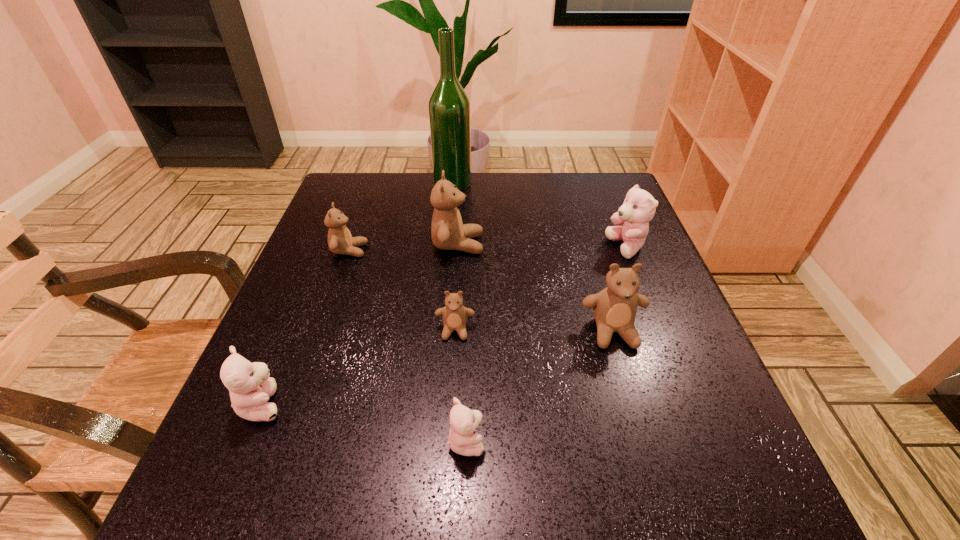
You are a GUI agent. You are given a task and a screenshot of the screen. Output one action in this format:
    pyautogui.click(x=<x>, y=<y>)
    Task: Click on the green alcohol
    
    Given the screenshot: What is the action you would take?
    pyautogui.click(x=449, y=107)

Where is `the farthest object`? the farthest object is located at coordinates (449, 107).

Identify the location of the tallest teddy bear. This screenshot has height=540, width=960. (448, 232).

You are a GUI agent. You are given a task and a screenshot of the screen. Output one action in this format:
    pyautogui.click(x=<x>, y=<y>)
    Task: Click on the seventh shortest object
    The image size is (960, 540).
    Given the screenshot: What is the action you would take?
    pyautogui.click(x=448, y=232)

Where is `the farthest pink teddy bear`? The height and width of the screenshot is (540, 960). the farthest pink teddy bear is located at coordinates (639, 206).

This screenshot has height=540, width=960. I want to click on the rightmost pink teddy bear, so click(x=639, y=206).

You are a GUI agent. You are given a task and a screenshot of the screen. Output one action in this format:
    pyautogui.click(x=<x>, y=<y>)
    Task: Click on the third smallest brown teddy bear
    This screenshot has width=960, height=540.
    Given the screenshot: What is the action you would take?
    pyautogui.click(x=614, y=308)

Identify the location of the second smallest brown teddy bear. (340, 241).

Where is `the leftmost pink teddy bear`? The image size is (960, 540). the leftmost pink teddy bear is located at coordinates (250, 386).

This screenshot has height=540, width=960. Identify the location of the smallest brown teddy bear. (454, 314).